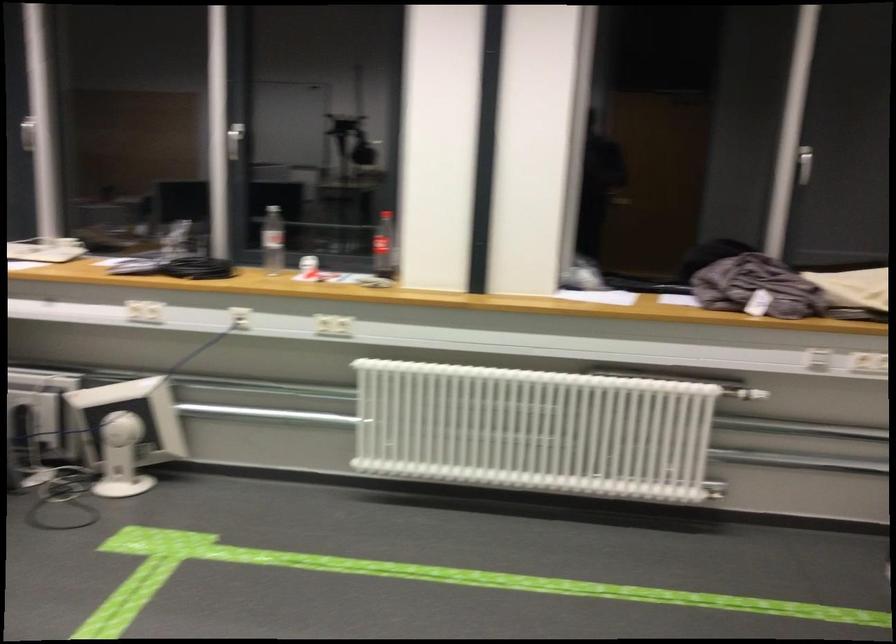
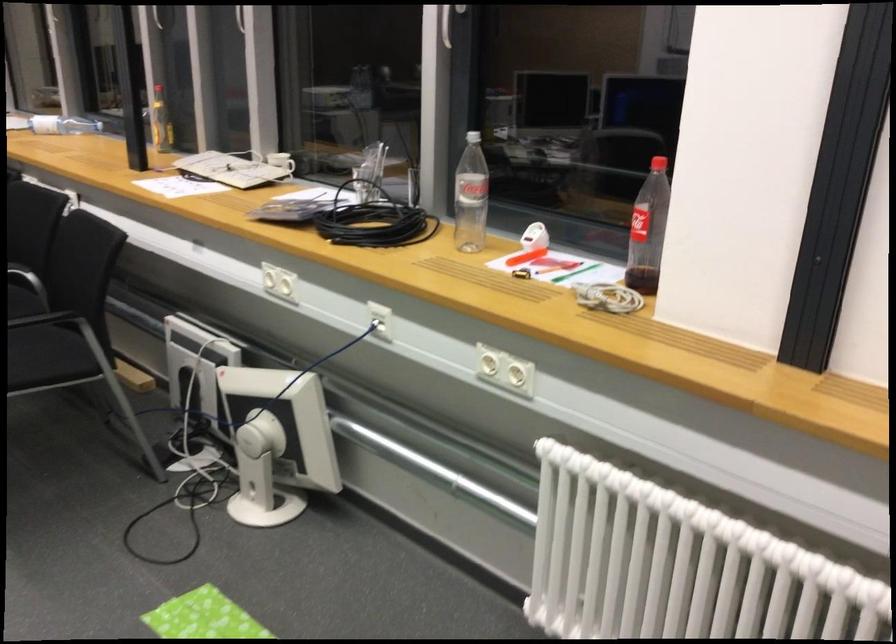
Locate, in the second image, the point that corresponds to the point at 140,433 in the first image.

(277, 442)